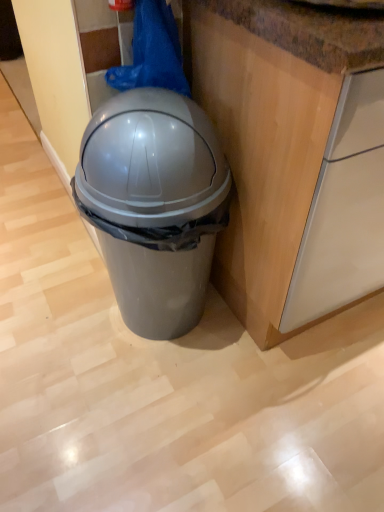
At what (x,y) coordinates should I click in order to perform the action: click on vacant space in front of matte gray plastic trash can at center. Please return your answer as a coordinate pair (x, y). The width and height of the screenshot is (384, 512). Looking at the image, I should click on (150, 421).